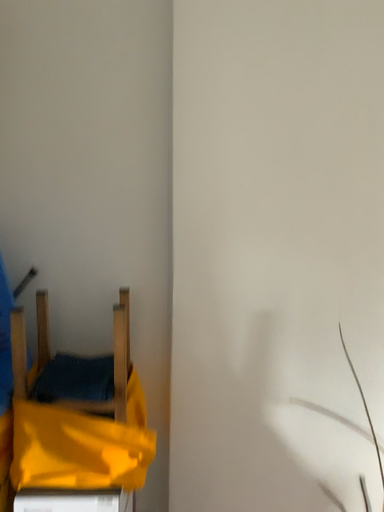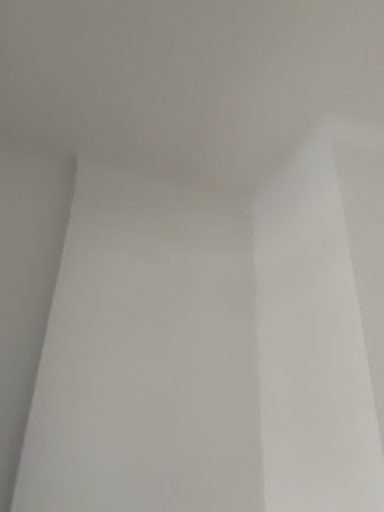
Question: Which way did the camera rotate in the video?

Choices:
 (A) rotated right
 (B) rotated left

Answer: (A)